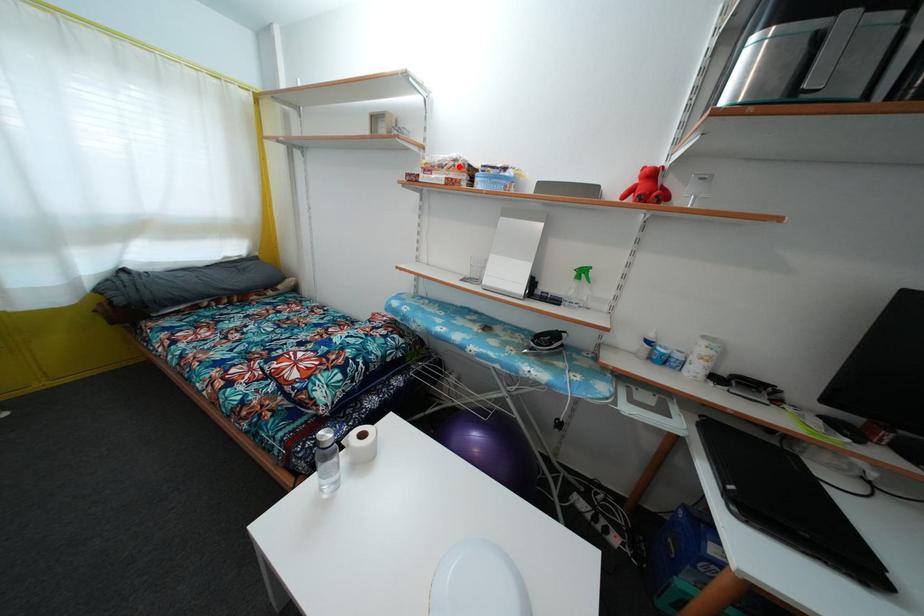
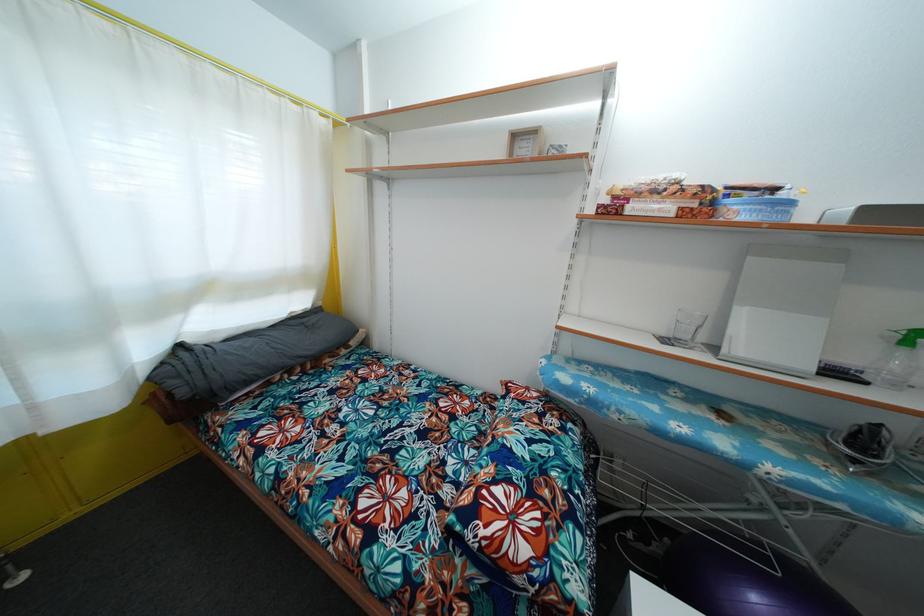
The point at the highlighted location is marked in the first image. Where is the corresponding point in the second image?

(683, 188)